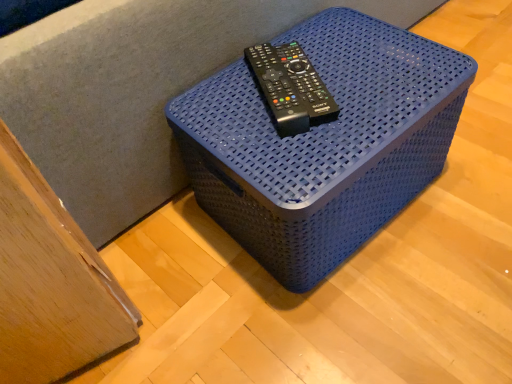
Locate an element on the screen. The image size is (512, 384). spots to the right of black plastic remote control at center is located at coordinates (373, 69).